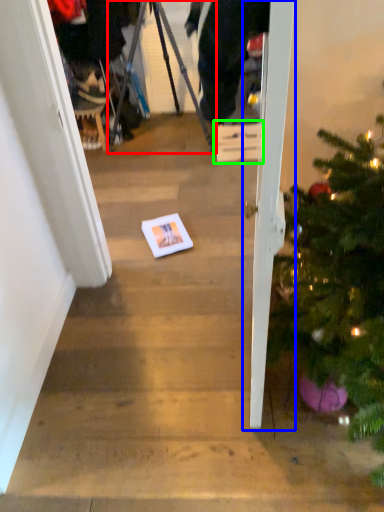
Question: Which is nearer to the tripod (highlighted by a red box)? door (highlighted by a blue box) or cardboard box (highlighted by a green box).

Choices:
 (A) door
 (B) cardboard box

Answer: (B)